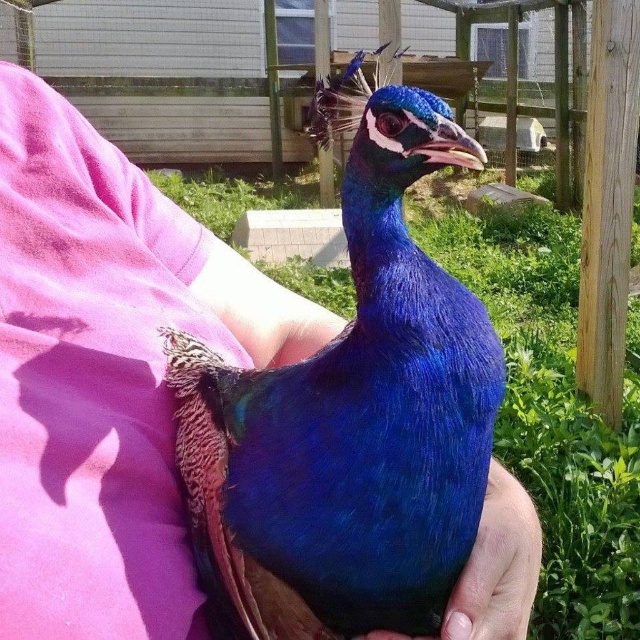
Is shiny blue peacock at center below satin blue feather at center?

No, shiny blue peacock at center is not below satin blue feather at center.

Which is in front, point (390, 456) or point (500, 589)?

Point (390, 456)

Describe the element at coordinates (348, 413) in the screenshot. I see `shiny blue peacock at center` at that location.

Locate an element on the screen. The height and width of the screenshot is (640, 640). shiny blue peacock at center is located at coordinates (348, 413).